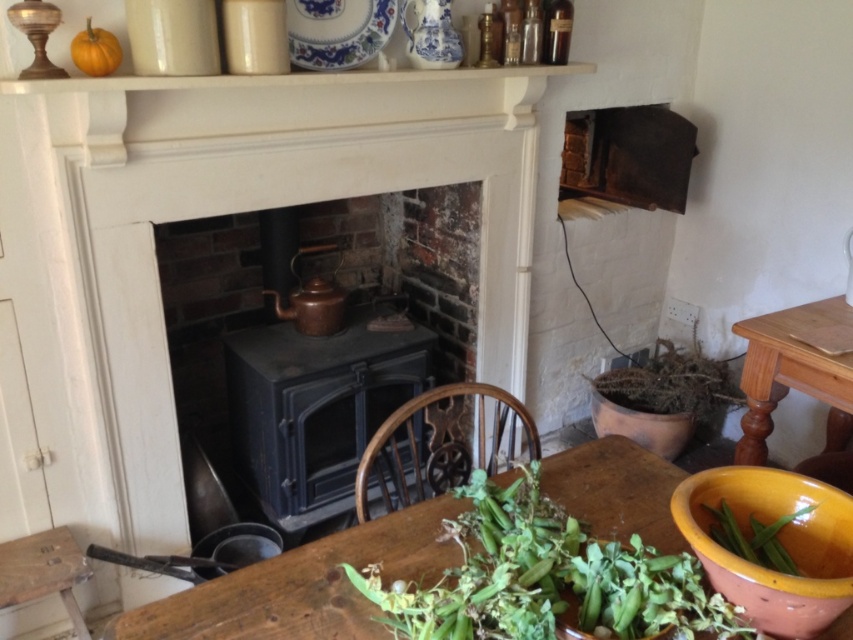
Between point (573, 566) and point (322, 61), which one is positioned behind?

Positioned behind is point (322, 61).

Is green leafy vegetable at lower center to the right of blue and white porcelain plate at upper center from the viewer's perspective?

Yes, green leafy vegetable at lower center is to the right of blue and white porcelain plate at upper center.

Find the location of a particular element. Image resolution: width=853 pixels, height=640 pixels. green leafy vegetable at lower center is located at coordinates (547, 579).

How distant is green leafy vegetable at lower center from orange matte pumpkin at upper left?

The distance of green leafy vegetable at lower center from orange matte pumpkin at upper left is 4.35 feet.

Can you confirm if green leafy vegetable at lower center is wider than orange matte pumpkin at upper left?

Correct, the width of green leafy vegetable at lower center exceeds that of orange matte pumpkin at upper left.

Locate an element on the screen. The height and width of the screenshot is (640, 853). green leafy vegetable at lower center is located at coordinates (547, 579).

Is wooden table at right positioned behind green leafy vegetable at lower right?

Yes, wooden table at right is behind green leafy vegetable at lower right.

The width and height of the screenshot is (853, 640). Describe the element at coordinates (793, 372) in the screenshot. I see `wooden table at right` at that location.

Locate an element on the screen. The image size is (853, 640). wooden table at right is located at coordinates (793, 372).